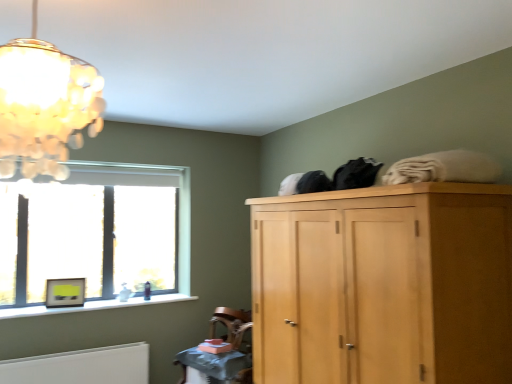
Question: Does clear glass window at left appear on the right side of translucent glass chandelier at upper left?

Choices:
 (A) no
 (B) yes

Answer: (A)

Question: Does clear glass window at left have a greater width compared to translucent glass chandelier at upper left?

Choices:
 (A) yes
 (B) no

Answer: (B)

Question: Is translucent glass chandelier at upper left at the back of clear glass window at left?

Choices:
 (A) yes
 (B) no

Answer: (B)

Question: Is the depth of clear glass window at left greater than that of translucent glass chandelier at upper left?

Choices:
 (A) yes
 (B) no

Answer: (A)

Question: Would you say clear glass window at left contains translucent glass chandelier at upper left?

Choices:
 (A) no
 (B) yes

Answer: (A)

Question: Is clear glass window at left shorter than translucent glass chandelier at upper left?

Choices:
 (A) yes
 (B) no

Answer: (B)

Question: Can wooden textured table at lower center be found inside clear glass window at left?

Choices:
 (A) yes
 (B) no

Answer: (B)

Question: From the image's perspective, is clear glass window at left on wooden textured table at lower center?

Choices:
 (A) yes
 (B) no

Answer: (A)

Question: From the image's perspective, is clear glass window at left located beneath wooden textured table at lower center?

Choices:
 (A) yes
 (B) no

Answer: (B)

Question: From a real-world perspective, is clear glass window at left physically above wooden textured table at lower center?

Choices:
 (A) no
 (B) yes

Answer: (B)

Question: Is clear glass window at left at the left side of wooden textured table at lower center?

Choices:
 (A) no
 (B) yes

Answer: (B)

Question: Does clear glass window at left have a greater width compared to wooden textured table at lower center?

Choices:
 (A) yes
 (B) no

Answer: (B)

Question: Considering the relative sizes of wooden textured table at lower center and matte yellow picture frame at window in the image provided, is wooden textured table at lower center wider than matte yellow picture frame at window?

Choices:
 (A) yes
 (B) no

Answer: (A)